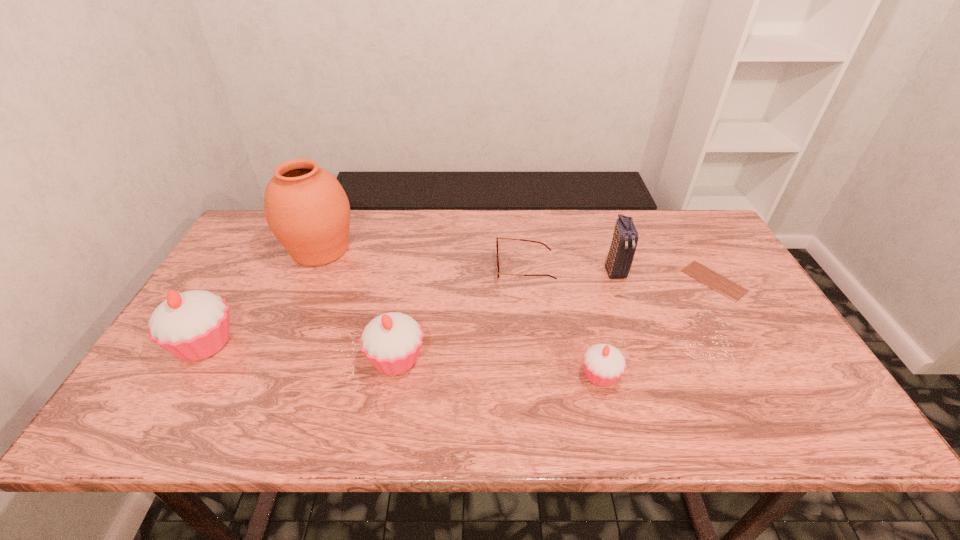
The width and height of the screenshot is (960, 540). Find the location of `urn that is positioned at the far edge`. urn that is positioned at the far edge is located at coordinates (306, 208).

At what (x,y) coordinates should I click in order to perform the action: click on spectacles positioned at the far edge. Please return your answer as a coordinate pair (x, y). This screenshot has height=540, width=960. Looking at the image, I should click on (497, 238).

Locate an element on the screen. The width and height of the screenshot is (960, 540). cupcake that is positioned at the left edge is located at coordinates (193, 325).

Locate an element on the screen. This screenshot has width=960, height=540. urn that is at the left edge is located at coordinates (306, 208).

Identify the location of object positioned at the right edge. Image resolution: width=960 pixels, height=540 pixels. (719, 283).

Image resolution: width=960 pixels, height=540 pixels. I want to click on object that is positioned at the far left corner, so (x=306, y=208).

Where is `object that is at the near left corner`? This screenshot has width=960, height=540. object that is at the near left corner is located at coordinates (193, 325).

You are a GUI agent. You are given a task and a screenshot of the screen. Output one action in this format:
    pyautogui.click(x=<x>, y=<y>)
    Task: Click on the vacant space at the far edge
    
    Given the screenshot: What is the action you would take?
    pyautogui.click(x=504, y=224)

In the image, there is a desktop. Where is `blank space at the near edge`? blank space at the near edge is located at coordinates (335, 366).

This screenshot has height=540, width=960. I want to click on vacant position at the left edge of the desktop, so [240, 262].